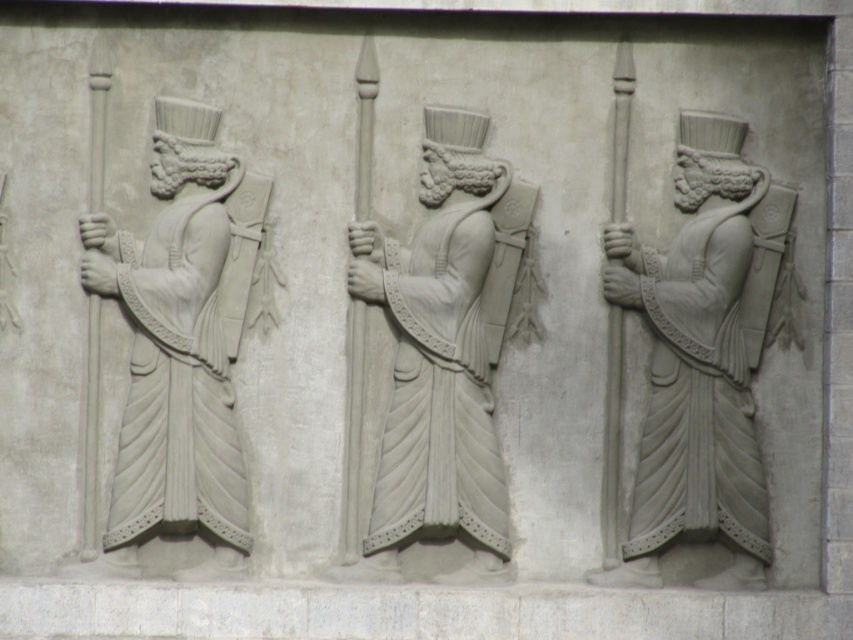
Question: Which object is the farthest from the white stone figure at left?

Choices:
 (A) white stone warrior at right
 (B) white stone figure at center

Answer: (A)

Question: Can you confirm if white stone warrior at right is thinner than white stone figure at left?

Choices:
 (A) no
 (B) yes

Answer: (A)

Question: Can you confirm if white stone warrior at right is smaller than white stone figure at left?

Choices:
 (A) yes
 (B) no

Answer: (B)

Question: Does white stone warrior at right have a smaller size compared to white stone figure at center?

Choices:
 (A) yes
 (B) no

Answer: (B)

Question: Which of the following is the farthest from the observer?

Choices:
 (A) (480, 492)
 (B) (701, 404)
 (C) (212, 496)

Answer: (B)

Question: Which object is farther from the camera taking this photo?

Choices:
 (A) white stone figure at left
 (B) white stone warrior at right

Answer: (B)